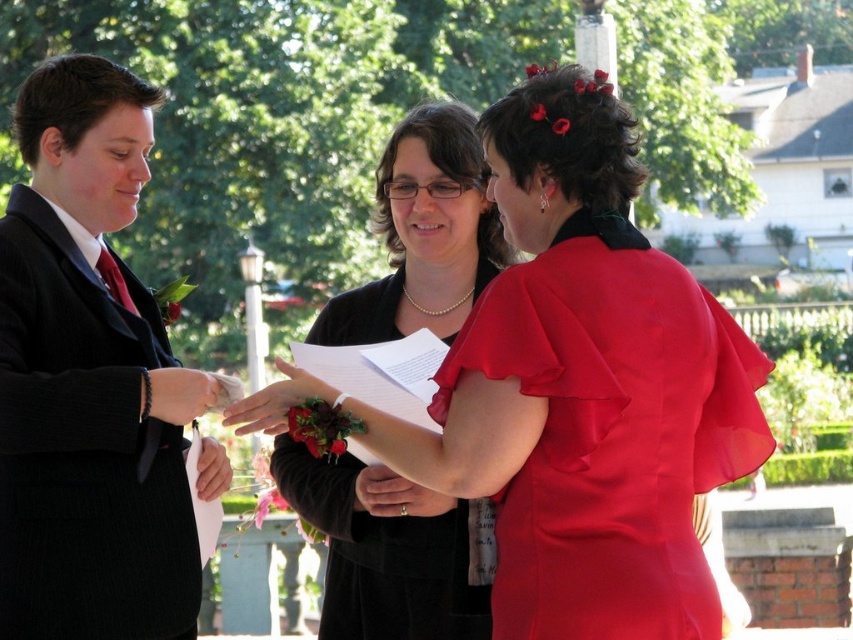
In the wedding scene, there are two items at the center of the image. The satin red dress at center and the pearl necklace at center. Which one is positioned to the right?

The satin red dress at center is positioned to the right of the pearl necklace at center.